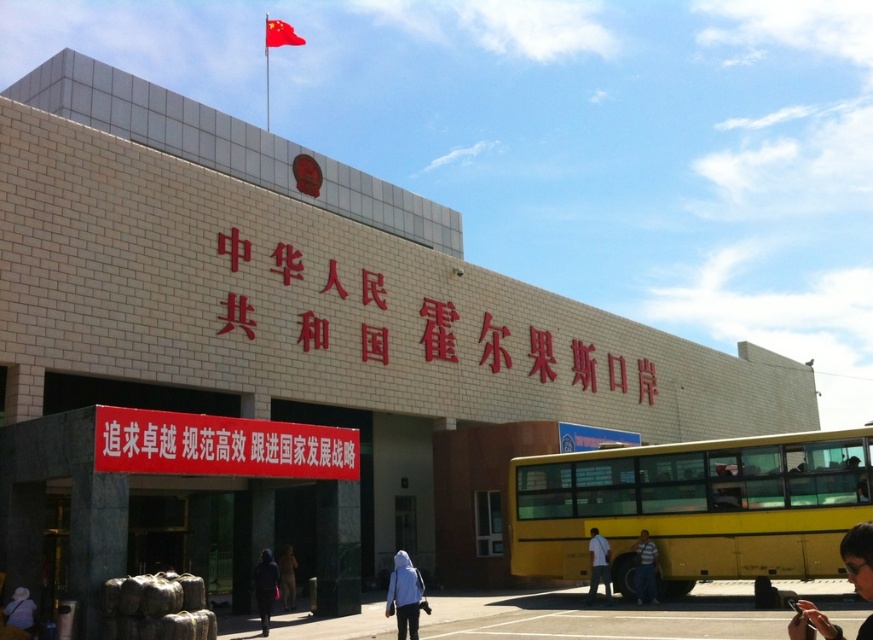
You are a tour guide leading a group to the entrance of the building. The entrance is behind the yellow matte bus at lower right and the white matte jacket at lower center. Can you walk through between them to reach the entrance?

The yellow matte bus at lower right might be wider than white matte jacket at lower center, so there may not be enough space to walk through between them to reach the entrance.